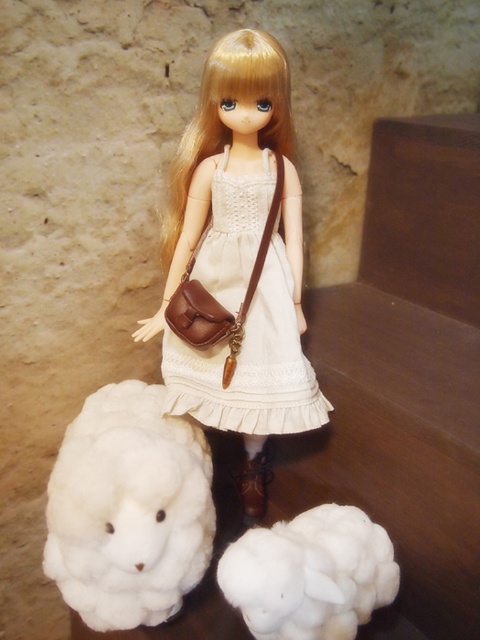
You are a photographer setting up a photo shoot with the doll and the sheep. You want to ensure that the white lace dress at center and the white fluffy sheep at lower left are both clearly visible in the frame. Given their sizes, which object should you place closer to the camera to maintain their visibility?

The white fluffy sheep at lower left is smaller than the white lace dress at center, so to ensure both are visible, you should place the white fluffy sheep at lower left closer to the camera.

Based on the coordinates provided, which object is located at point [251,365]?

The white lace dress at center is located at point [251,365].

You are a photographer trying to capture the doll and the sheep in a clear photo. Since the fluffy white lamb at lower left and the white lace dress at center are both white, will the lamb appear in front of the dress in the photo?

Yes, the fluffy white lamb at lower left is in front of the white lace dress at center, so it will appear in front in the photo.